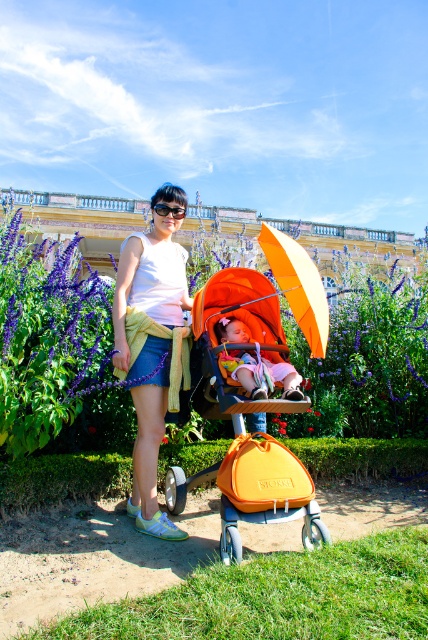
Question: Among these objects, which one is farthest from the camera?

Choices:
 (A) purple matte flower at upper left
 (B) denim skirt at center

Answer: (A)

Question: Can you confirm if purple matte flower at upper left is smaller than denim skirt at center?

Choices:
 (A) yes
 (B) no

Answer: (B)

Question: Can you confirm if denim skirt at center is wider than orange matte umbrella at center?

Choices:
 (A) no
 (B) yes

Answer: (A)

Question: Which point is farther to the camera?

Choices:
 (A) (168, 360)
 (B) (309, 340)

Answer: (B)

Question: Considering the real-world distances, which object is closest to the orange fabric stroller at center?

Choices:
 (A) denim skirt at center
 (B) orange matte umbrella at center
 (C) orange matte baby carriage at center
 (D) purple matte flower at upper left

Answer: (C)

Question: Can you confirm if denim skirt at center is thinner than orange matte umbrella at center?

Choices:
 (A) yes
 (B) no

Answer: (A)